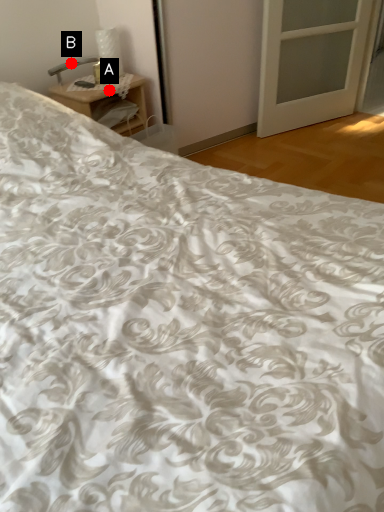
Question: Two points are circled on the image, labeled by A and B beside each circle. Which point is farther from the camera taking this photo?

Choices:
 (A) A is further
 (B) B is further

Answer: (B)